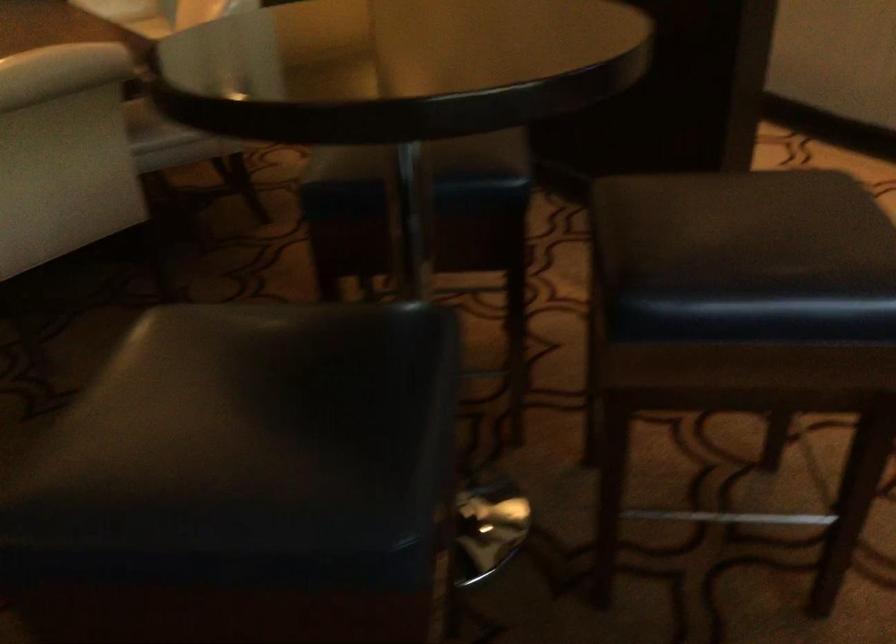
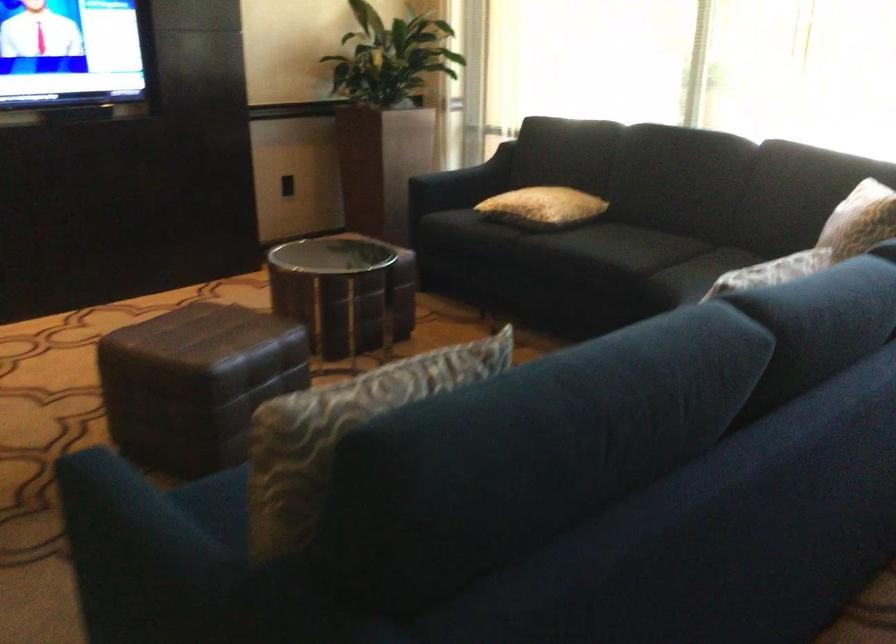
Based on the continuous images, in which direction is the camera rotating?

The rotation direction of the camera is right-down.